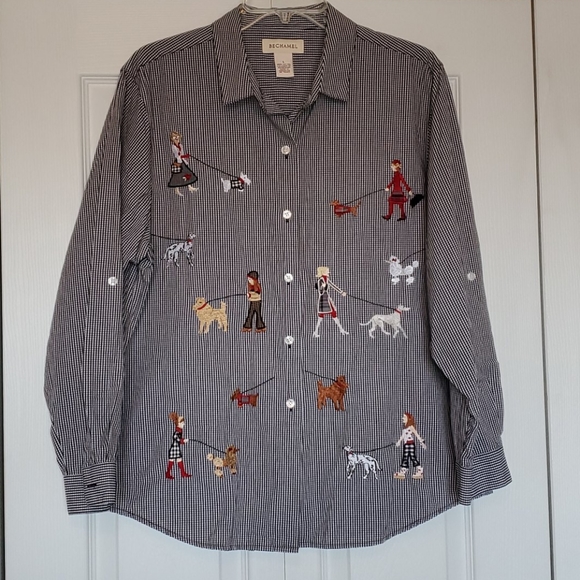
This screenshot has width=580, height=580. What are the coordinates of `artwork middle right` in the screenshot? It's located at (402, 255).